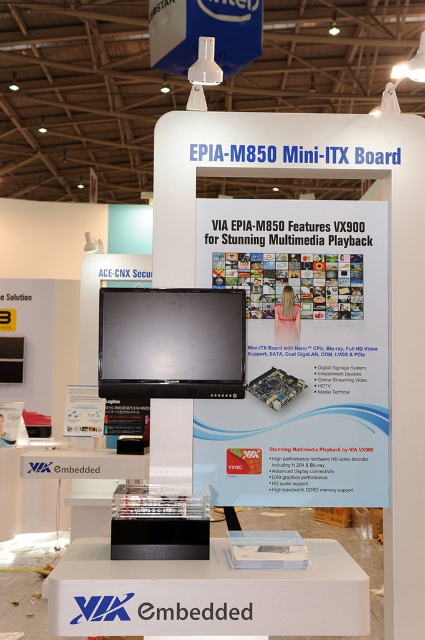
Can you confirm if silver metallic motherboard at center is shorter than blonde hair at upper center?

Indeed, silver metallic motherboard at center has a lesser height compared to blonde hair at upper center.

Does silver metallic motherboard at center have a greater width compared to blonde hair at upper center?

Correct, the width of silver metallic motherboard at center exceeds that of blonde hair at upper center.

Find the location of a particular element. The width and height of the screenshot is (425, 640). silver metallic motherboard at center is located at coordinates (275, 387).

Does white glossy poster at center have a lesser height compared to blonde hair at upper center?

In fact, white glossy poster at center may be taller than blonde hair at upper center.

Can you confirm if white glossy poster at center is smaller than blonde hair at upper center?

Incorrect, white glossy poster at center is not smaller in size than blonde hair at upper center.

Locate an element on the screen. white glossy poster at center is located at coordinates (300, 353).

Where is `white glossy poster at center`? Image resolution: width=425 pixels, height=640 pixels. white glossy poster at center is located at coordinates (300, 353).

I want to click on white glossy poster at center, so click(x=300, y=353).

Between point (323, 221) and point (255, 378), which one is positioned behind?

Positioned behind is point (323, 221).

What do you see at coordinates (300, 353) in the screenshot? I see `white glossy poster at center` at bounding box center [300, 353].

The width and height of the screenshot is (425, 640). I want to click on white glossy poster at center, so click(x=300, y=353).